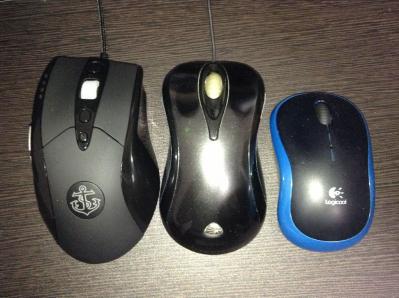
Find the location of a particular element. woodgrain tabletop is located at coordinates (133, 278).